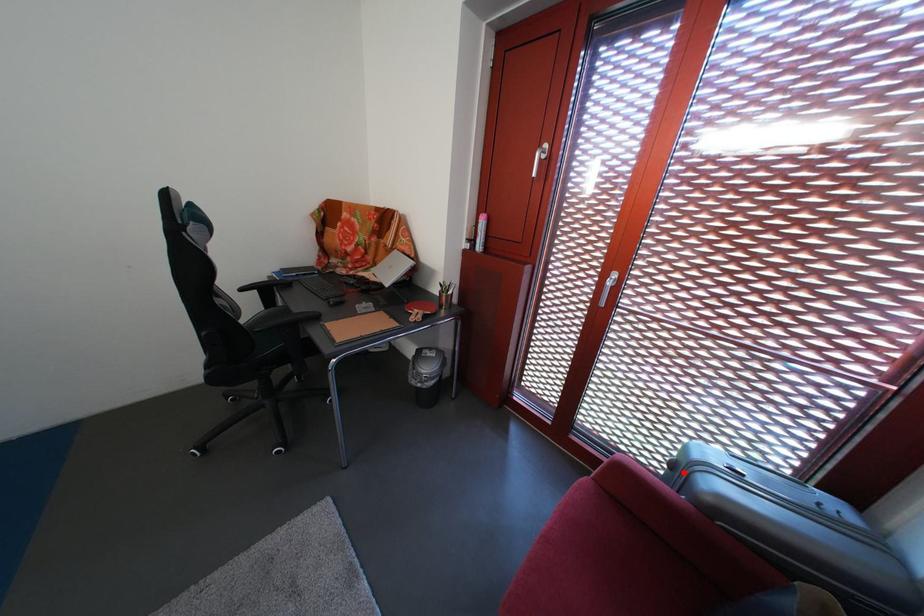
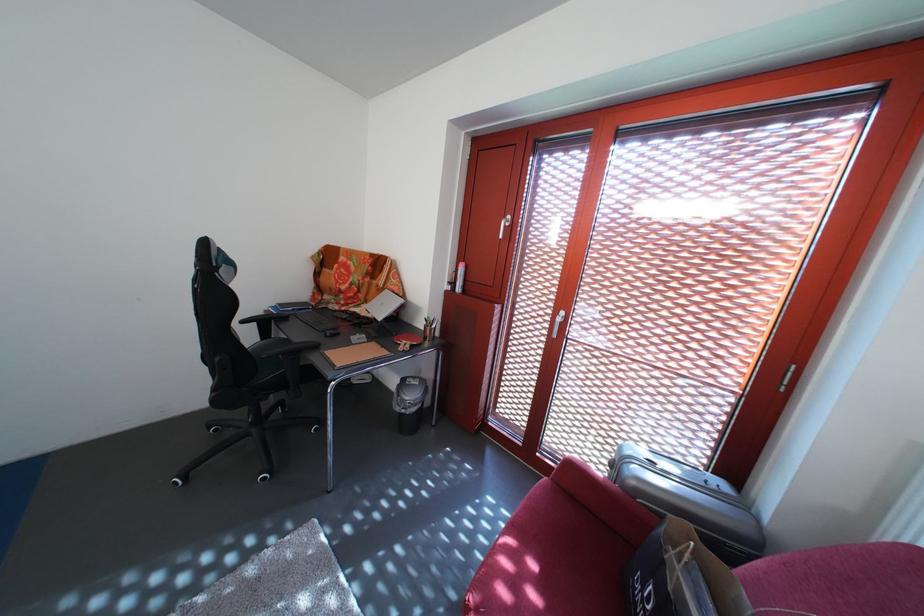
Question: I am providing you with two images of the same scene from different viewpoints. Given a red point in image1, look at the same physical point in image2. Is it:

Choices:
 (A) Closer to the viewpoint
 (B) Farther from the viewpoint

Answer: (B)